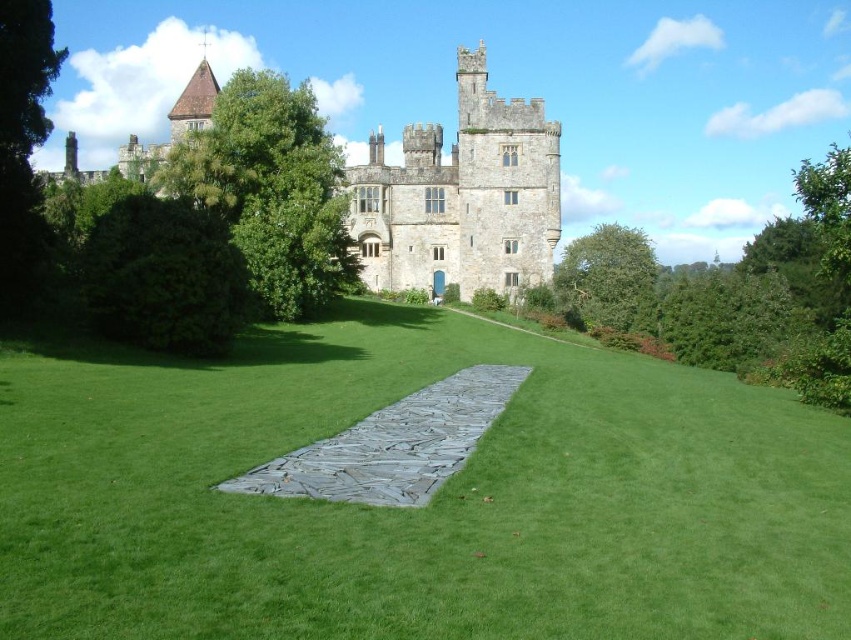
In the scene shown: You are standing at the point labeled as point (418, 508) in the image. Based on the scene description, what is the immediate surface you are standing on?

The point (418, 508) corresponds to green grass at center, so you are standing on green grass at center.

From the picture: You are planning to host a picnic and need to choose between the green grass at center and the gray stone path at center for setting up. Based on the scene description, which area is more spacious for your picnic setup?

The green grass at center is more spacious for the picnic setup because it has a larger size compared to the gray stone path at center.